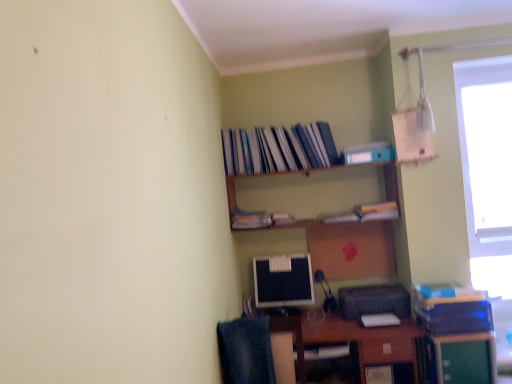
Locate an element on the screen. This screenshot has height=384, width=512. free space above blue matte paperback book at lower right, positioned as the 2th paperback book in back-to-front order (from a real-world perspective) is located at coordinates (450, 292).